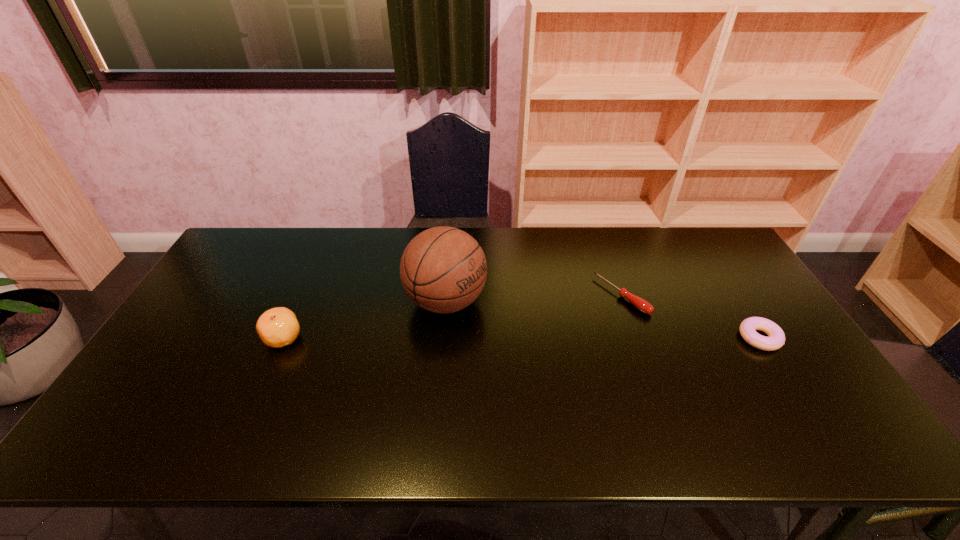
Where is `free space on the desktop that is between the second tallest object and the rightmost object and is positioned at the tip of the third object from left to right`? The height and width of the screenshot is (540, 960). free space on the desktop that is between the second tallest object and the rightmost object and is positioned at the tip of the third object from left to right is located at coordinates (557, 338).

You are a GUI agent. You are given a task and a screenshot of the screen. Output one action in this format:
    pyautogui.click(x=<x>, y=<y>)
    Task: Click on the vacant space on the desktop that is between the clementine and the rightmost object and is positioned on the side with brand label of the basketball
    
    Given the screenshot: What is the action you would take?
    pyautogui.click(x=516, y=338)